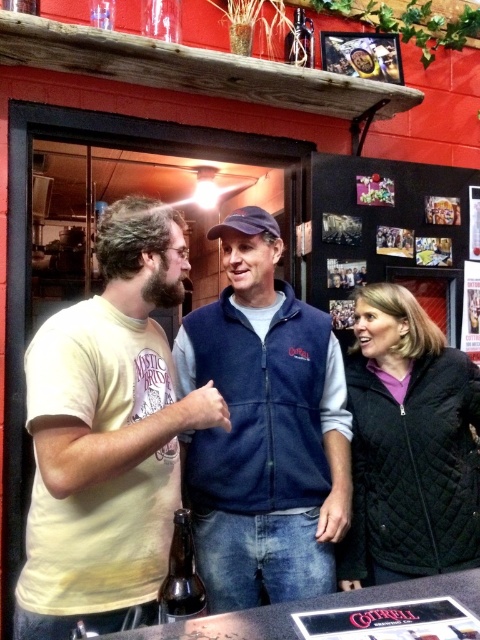
Question: Is yellow t-shirt at left closer to camera compared to navy fleece vest at center?

Choices:
 (A) yes
 (B) no

Answer: (A)

Question: Is yellow t-shirt at left thinner than navy fleece vest at center?

Choices:
 (A) yes
 (B) no

Answer: (A)

Question: Based on their relative distances, which object is farther from the black quilted jacket at right?

Choices:
 (A) yellow t-shirt at left
 (B) navy fleece vest at center
 (C) brown glass bottle at center

Answer: (C)

Question: Can you confirm if black quilted jacket at right is positioned above brown glass bottle at center?

Choices:
 (A) yes
 (B) no

Answer: (A)

Question: Which point is closer to the camera?

Choices:
 (A) brown glass bottle at center
 (B) navy fleece vest at center
 (C) yellow t-shirt at left

Answer: (C)

Question: Which point is closer to the camera?

Choices:
 (A) (186, 529)
 (B) (86, 380)
 (C) (182, 337)

Answer: (B)